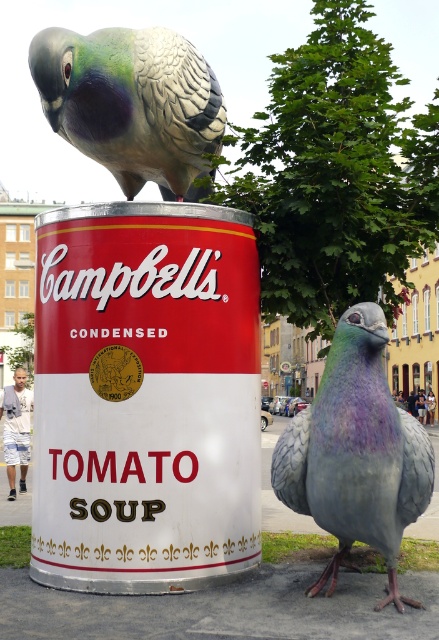
Who is positioned more to the left, shiny metallic pigeon at center or green feathered parrot at upper left?

green feathered parrot at upper left

Which is in front, point (291, 422) or point (108, 65)?

Point (291, 422) is in front.

Identify the location of shiny metallic pigeon at center. Image resolution: width=439 pixels, height=640 pixels. (356, 452).